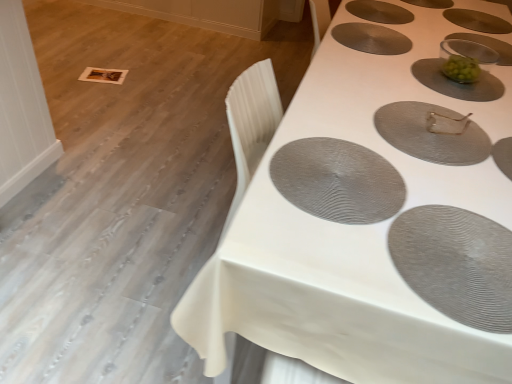
I want to click on vacant area that lies between matte gray placemat at upper center, arranged as the third oval when viewed from the back, and textured gray oval at center, the 6th oval in the back-to-front sequence, so click(x=346, y=86).